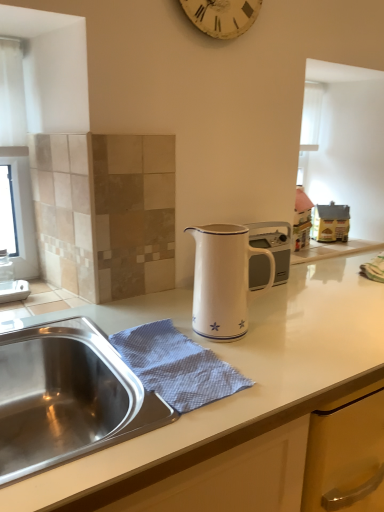
You are a GUI agent. You are given a task and a screenshot of the screen. Output one action in this format:
    pyautogui.click(x=<x>, y=<y>)
    Task: Click on the blue textured cloth at sink
    Image resolution: width=384 pixels, height=512 pixels.
    Given the screenshot: What is the action you would take?
    tap(176, 366)

Where is `white textured clock at upper center`? The image size is (384, 512). white textured clock at upper center is located at coordinates (222, 16).

What is the approximate height of white textured clock at upper center?

It is 11.73 inches.

Identify the location of blue textured cloth at sink. pos(176,366).

Can you confirm if white enamel jug at center is wider than blue textured cloth at sink?

In fact, white enamel jug at center might be narrower than blue textured cloth at sink.

Considering their positions, is white enamel jug at center located in front of or behind blue textured cloth at sink?

In the image, white enamel jug at center appears behind blue textured cloth at sink.

Would you say white textured clock at upper center contains blue textured cloth at sink?

No, blue textured cloth at sink is not inside white textured clock at upper center.

Which is in front, point (188, 4) or point (169, 398)?

The point (169, 398) is closer.

Is white textured clock at upper center at the left side of blue textured cloth at sink?

No, white textured clock at upper center is not to the left of blue textured cloth at sink.

In terms of size, does white textured clock at upper center appear bigger or smaller than blue textured cloth at sink?

Considering their sizes, white textured clock at upper center takes up more space than blue textured cloth at sink.

Between blue textured cloth at sink and white textured clock at upper center, which one appears on the right side from the viewer's perspective?

From the viewer's perspective, white textured clock at upper center appears more on the right side.

Is blue textured cloth at sink looking in the opposite direction of white textured clock at upper center?

No, blue textured cloth at sink's orientation is not away from white textured clock at upper center.

Identify the location of blanket that is below the white textured clock at upper center (from the image's perspective). Image resolution: width=384 pixels, height=512 pixels. (176, 366).

From a real-world perspective, is blue textured cloth at sink physically above white textured clock at upper center?

Actually, blue textured cloth at sink is physically below white textured clock at upper center in the real world.

Is white enamel jug at center far from white glossy pitcher at center?

They are positioned close to each other.

Consider the image. Does white enamel jug at center turn towards white glossy pitcher at center?

No, white enamel jug at center does not turn towards white glossy pitcher at center.

Identify the location of jug above the white glossy pitcher at center (from the image's perspective). (223, 280).

How different are the orientations of white glossy pitcher at center and white textured clock at upper center in degrees?

Result: 0.569 degrees.

Considering the sizes of white glossy pitcher at center and white textured clock at upper center in the image, is white glossy pitcher at center bigger or smaller than white textured clock at upper center?

Considering their sizes, white glossy pitcher at center takes up more space than white textured clock at upper center.

From the image's perspective, relative to white textured clock at upper center, is white glossy pitcher at center above or below?

white glossy pitcher at center is situated lower than white textured clock at upper center in the image.

Between white glossy pitcher at center and white textured clock at upper center, which one has less height?

Standing shorter between the two is white textured clock at upper center.

Between white textured clock at upper center and white glossy pitcher at center, which one has more height?

white glossy pitcher at center.

What's the angular difference between white textured clock at upper center and white glossy pitcher at center's facing directions?

The angle between the facing direction of white textured clock at upper center and the facing direction of white glossy pitcher at center is 0.569 degrees.

Considering the relative positions of white textured clock at upper center and white glossy pitcher at center in the image provided, is white textured clock at upper center to the right of white glossy pitcher at center from the viewer's perspective?

Incorrect, white textured clock at upper center is not on the right side of white glossy pitcher at center.

From a real-world perspective, between white textured clock at upper center and white glossy pitcher at center, who is vertically higher?

white textured clock at upper center, from a real-world perspective.

From the image's perspective, is white enamel jug at center located above or below white textured clock at upper center?

white enamel jug at center is below white textured clock at upper center.

From a real-world perspective, which object rests below the other?

white enamel jug at center, from a real-world perspective.

Is white enamel jug at center positioned in front of white textured clock at upper center?

Yes, it is in front of white textured clock at upper center.

Is white enamel jug at center oriented away from white textured clock at upper center?

No.

Locate an element on the screen. This screenshot has width=384, height=512. jug that appears above the blue textured cloth at sink (from the image's perspective) is located at coordinates tap(223, 280).

You are a GUI agent. You are given a task and a screenshot of the screen. Output one action in this format:
    pyautogui.click(x=<x>, y=<y>)
    Task: Click on the clock above the blue textured cloth at sink (from a real-world perspective)
    This screenshot has width=384, height=512.
    Given the screenshot: What is the action you would take?
    pyautogui.click(x=222, y=16)

Considering their positions, is white glossy pitcher at center positioned closer to white enamel jug at center than white textured clock at upper center?

white glossy pitcher at center lies closer to white enamel jug at center than the other object.

Consider the image. Which object lies nearer to the anchor point white enamel jug at center, blue textured cloth at sink or white textured clock at upper center?

blue textured cloth at sink.

From the image, which object appears to be nearer to white textured clock at upper center, white glossy pitcher at center or white enamel jug at center?

white enamel jug at center is positioned closer to the anchor white textured clock at upper center.

Looking at the image, which one is located further to white textured clock at upper center, blue textured cloth at sink or white enamel jug at center?

blue textured cloth at sink is further to white textured clock at upper center.

Based on their spatial positions, is white enamel jug at center or blue textured cloth at sink further from white textured clock at upper center?

Among the two, blue textured cloth at sink is located further to white textured clock at upper center.

When comparing their distances from white textured clock at upper center, does white glossy pitcher at center or blue textured cloth at sink seem further?

Among the two, blue textured cloth at sink is located further to white textured clock at upper center.

From the image, which object appears to be nearer to blue textured cloth at sink, white textured clock at upper center or white enamel jug at center?

white enamel jug at center lies closer to blue textured cloth at sink than the other object.

Estimate the real-world distances between objects in this image. Which object is closer to blue textured cloth at sink, white textured clock at upper center or white glossy pitcher at center?

white glossy pitcher at center is positioned closer to the anchor blue textured cloth at sink.

The height and width of the screenshot is (512, 384). In order to click on blanket between white textured clock at upper center and white glossy pitcher at center from top to bottom in this screenshot , I will do `click(176, 366)`.

Where is `jug between white textured clock at upper center and white glossy pitcher at center from top to bottom`? jug between white textured clock at upper center and white glossy pitcher at center from top to bottom is located at coordinates (223, 280).

Image resolution: width=384 pixels, height=512 pixels. I want to click on jug between blue textured cloth at sink and white glossy pitcher at center from left to right, so click(x=223, y=280).

Identify the location of jug between white textured clock at upper center and blue textured cloth at sink from top to bottom. This screenshot has height=512, width=384. (223, 280).